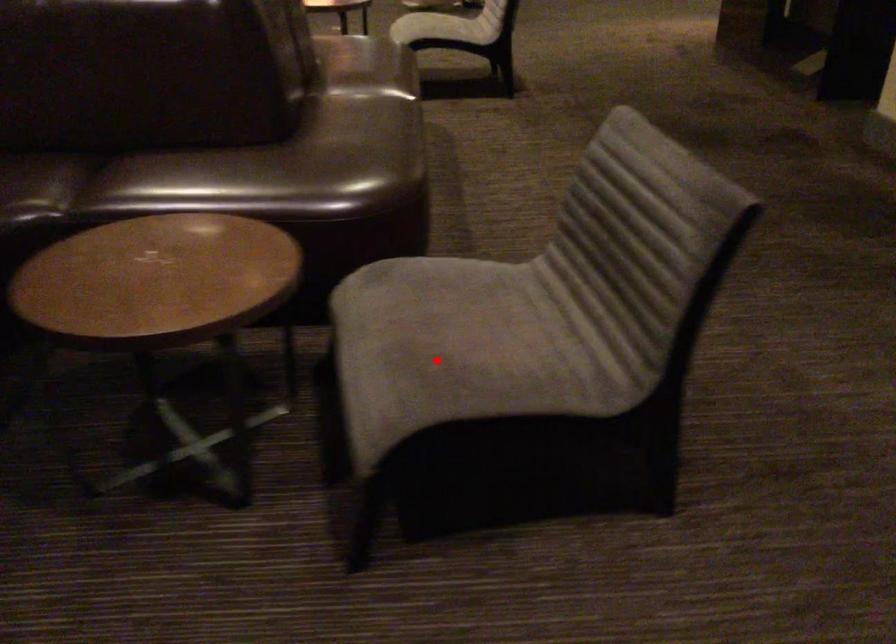
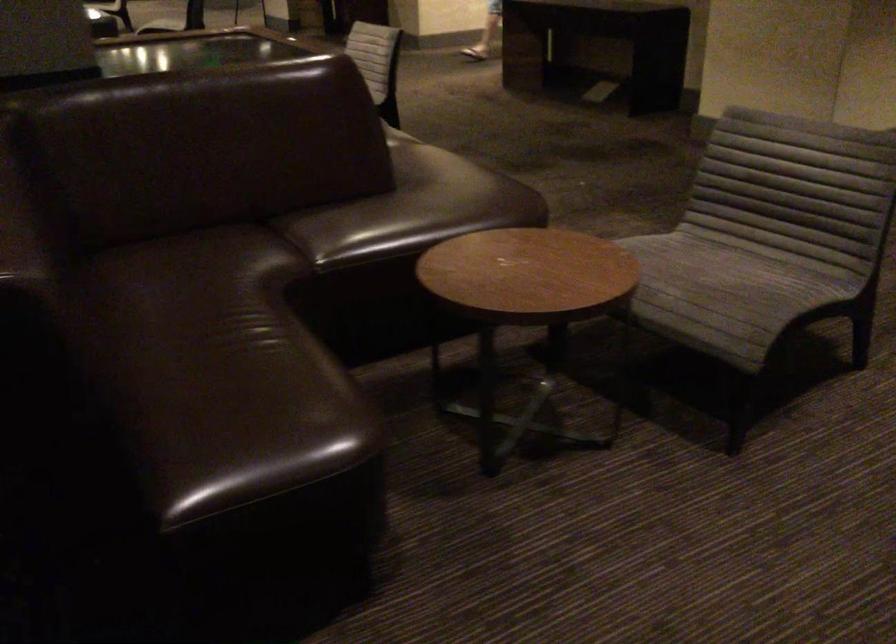
In the second image, find the point that corresponds to the highlighted location in the first image.

(722, 286)